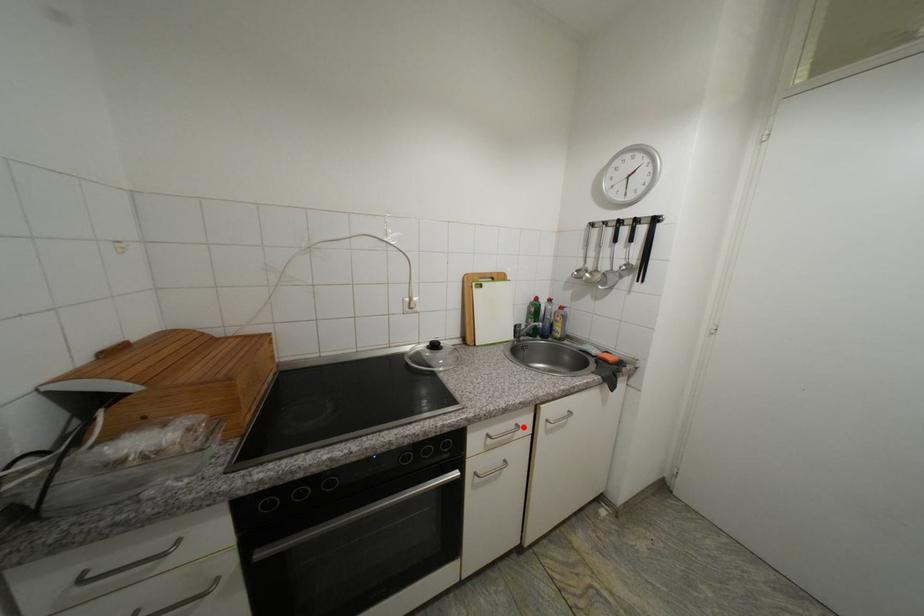
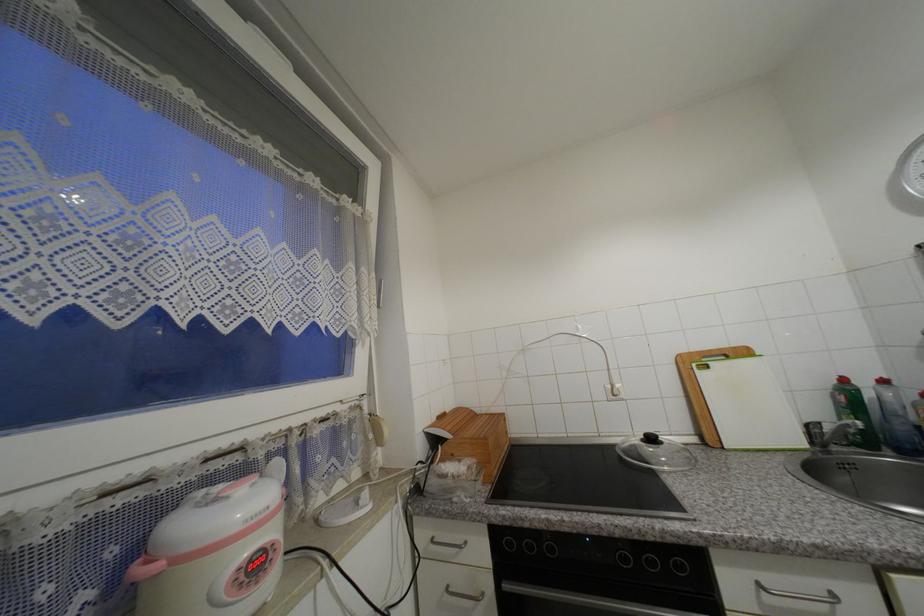
Question: I am providing you with two images of the same scene from different viewpoints. A red point is marked on the first image. At the location where the point appears in image 1, is it still visible in image 2?

Choices:
 (A) Yes
 (B) No

Answer: (A)